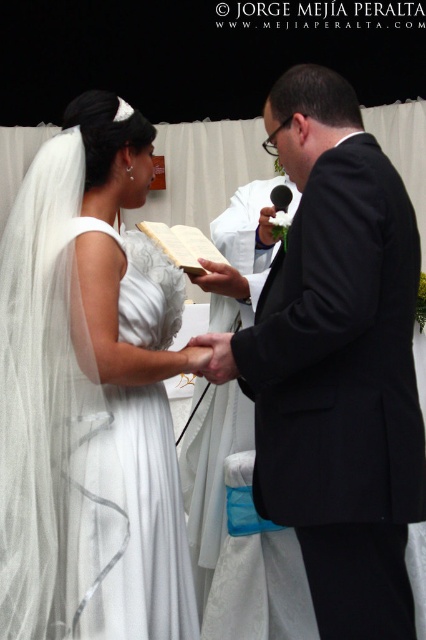
Who is lower down, white satin dress at center or white paper book at center?

white satin dress at center is lower down.

Does white satin dress at center have a lesser width compared to white paper book at center?

No, white satin dress at center is not thinner than white paper book at center.

Between point (60, 634) and point (155, 230), which one is positioned in front?

Point (60, 634)

You are a GUI agent. You are given a task and a screenshot of the screen. Output one action in this format:
    pyautogui.click(x=<x>, y=<y>)
    Task: Click on the white satin dress at center
    The height and width of the screenshot is (640, 426).
    Given the screenshot: What is the action you would take?
    pyautogui.click(x=89, y=396)